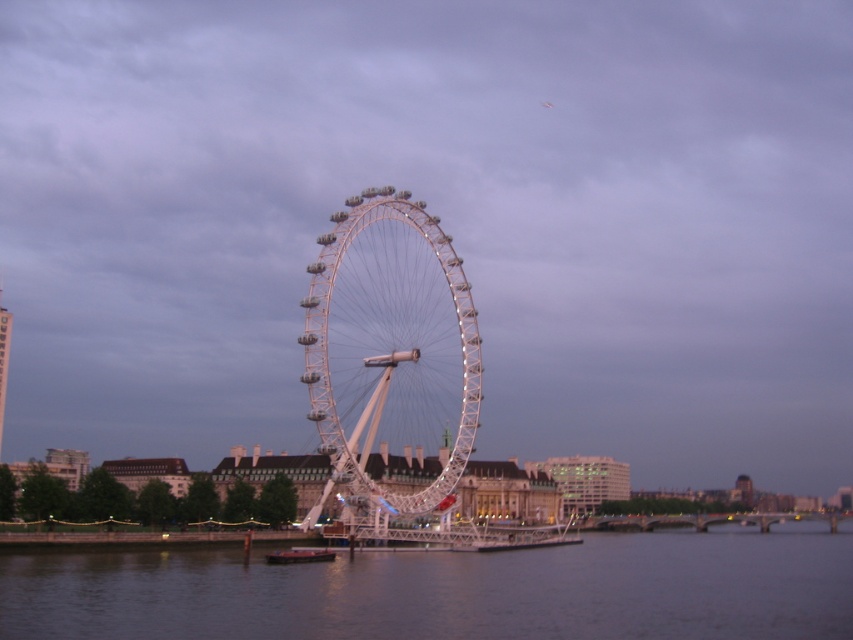
Is dark blue water at center in front of metallic gray barge at lower center?

Yes.

The image size is (853, 640). What do you see at coordinates (450, 589) in the screenshot?
I see `dark blue water at center` at bounding box center [450, 589].

Locate an element on the screen. This screenshot has width=853, height=640. dark blue water at center is located at coordinates (450, 589).

From the picture: Between dark blue water at center and white metallic ferris wheel at center, which one is positioned higher?

white metallic ferris wheel at center

What do you see at coordinates (450, 589) in the screenshot? I see `dark blue water at center` at bounding box center [450, 589].

Is point (695, 545) positioned after point (424, 356)?

No.

Where is `dark blue water at center`? dark blue water at center is located at coordinates (450, 589).

Is white metallic ferris wheel at center in front of metallic gray barge at lower center?

No, it is not.

Does white metallic ferris wheel at center appear under metallic gray barge at lower center?

No.

The image size is (853, 640). What do you see at coordinates (390, 358) in the screenshot?
I see `white metallic ferris wheel at center` at bounding box center [390, 358].

Locate an element on the screen. The width and height of the screenshot is (853, 640). white metallic ferris wheel at center is located at coordinates (390, 358).